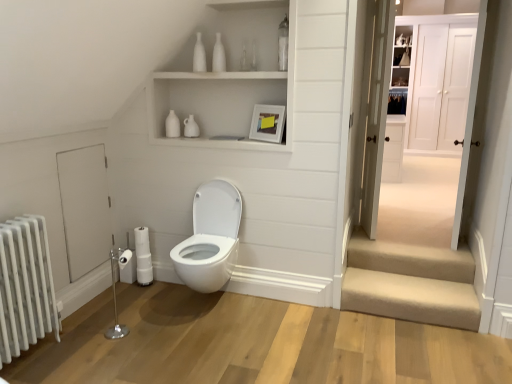
Question: Is white glossy door at right, which is counted as the second door, starting from the front, facing towards white wood door at upper right, positioned as the 4th door in front-to-back order?

Choices:
 (A) yes
 (B) no

Answer: (B)

Question: Is white glossy door at right, the 3th door positioned from the back, in front of white wood door at upper right, which ranks as the fourth door in left-to-right order?

Choices:
 (A) no
 (B) yes

Answer: (B)

Question: Can you see white glossy door at right, arranged as the second door when viewed from the left, touching white wood door at upper right, positioned as the 4th door in front-to-back order?

Choices:
 (A) no
 (B) yes

Answer: (A)

Question: Considering the relative sizes of white glossy door at right, which is counted as the second door, starting from the front, and white wood door at upper right, the first door viewed from the right, in the image provided, is white glossy door at right, which is counted as the second door, starting from the front, taller than white wood door at upper right, the first door viewed from the right,?

Choices:
 (A) yes
 (B) no

Answer: (B)

Question: Is white glossy door at right, the third door positioned from the right, positioned beyond the bounds of white wood door at upper right, which ranks as the fourth door in left-to-right order?

Choices:
 (A) no
 (B) yes

Answer: (B)

Question: Considering the positions of point (426, 74) and point (360, 269), is point (426, 74) closer or farther from the camera than point (360, 269)?

Choices:
 (A) closer
 (B) farther

Answer: (B)

Question: From the image's perspective, is white wood door at upper right, positioned as the 4th door in front-to-back order, above or below beige carpeted stairs at lower right?

Choices:
 (A) below
 (B) above

Answer: (B)

Question: Is white wood door at upper right, which ranks as the fourth door in left-to-right order, bigger or smaller than beige carpeted stairs at lower right?

Choices:
 (A) big
 (B) small

Answer: (A)

Question: Is white wood door at upper right, positioned as the 4th door in front-to-back order, in front of or behind beige carpeted stairs at lower right in the image?

Choices:
 (A) behind
 (B) front

Answer: (A)

Question: From a real-world perspective, is white wooden door at upper right, the 2th door from the back, physically located above or below white marble radiator at left?

Choices:
 (A) above
 (B) below

Answer: (A)

Question: Looking at the image, does white wooden door at upper right, positioned as the second door in right-to-left order, seem bigger or smaller compared to white marble radiator at left?

Choices:
 (A) big
 (B) small

Answer: (B)

Question: In terms of width, does white wooden door at upper right, positioned as the second door in right-to-left order, look wider or thinner when compared to white marble radiator at left?

Choices:
 (A) thin
 (B) wide

Answer: (A)

Question: Is point (416, 198) closer or farther from the camera than point (34, 248)?

Choices:
 (A) closer
 (B) farther

Answer: (B)

Question: In terms of height, does white marble radiator at left look taller or shorter compared to white wooden door at upper right, the third door in the left-to-right sequence?

Choices:
 (A) tall
 (B) short

Answer: (B)

Question: Considering the positions of white marble radiator at left and white wooden door at upper right, the third door in the left-to-right sequence, in the image, is white marble radiator at left bigger or smaller than white wooden door at upper right, the third door in the left-to-right sequence,?

Choices:
 (A) big
 (B) small

Answer: (A)